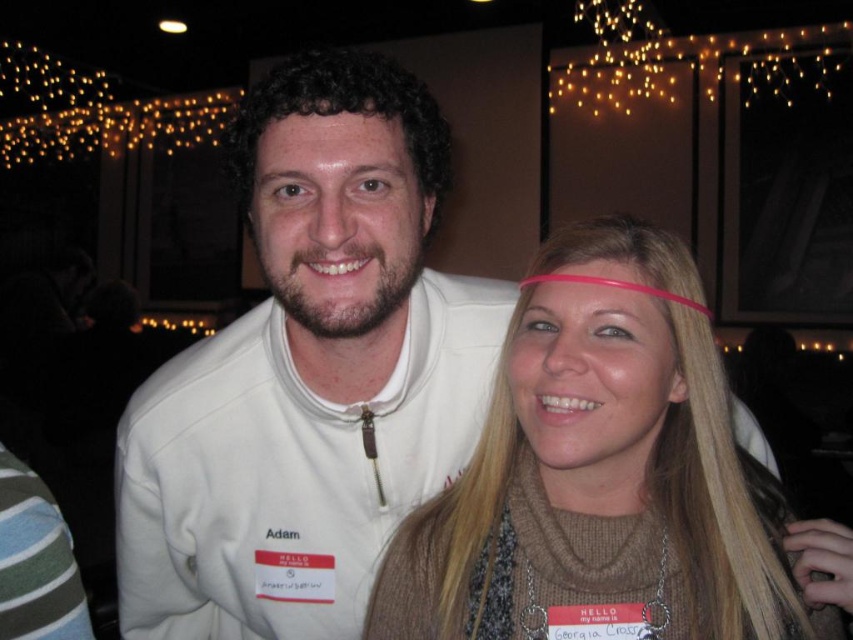
Who is higher up, white fleece jacket at center or shiny skin forehead at center?

Positioned higher is shiny skin forehead at center.

Can you confirm if white fleece jacket at center is wider than shiny skin forehead at center?

Correct, the width of white fleece jacket at center exceeds that of shiny skin forehead at center.

Locate an element on the screen. This screenshot has height=640, width=853. white fleece jacket at center is located at coordinates [306, 387].

Is blonde hair at center closer to the viewer compared to shiny skin forehead at center?

Yes, it is in front of shiny skin forehead at center.

Which of these two, blonde hair at center or shiny skin forehead at center, stands shorter?

Standing shorter between the two is shiny skin forehead at center.

Where is `blonde hair at center`? This screenshot has height=640, width=853. blonde hair at center is located at coordinates (602, 474).

Between white fleece jacket at center and blonde hair at center, which one has less height?

With less height is blonde hair at center.

Is point (415, 460) positioned after point (579, 296)?

Yes.

This screenshot has height=640, width=853. I want to click on white fleece jacket at center, so click(306, 387).